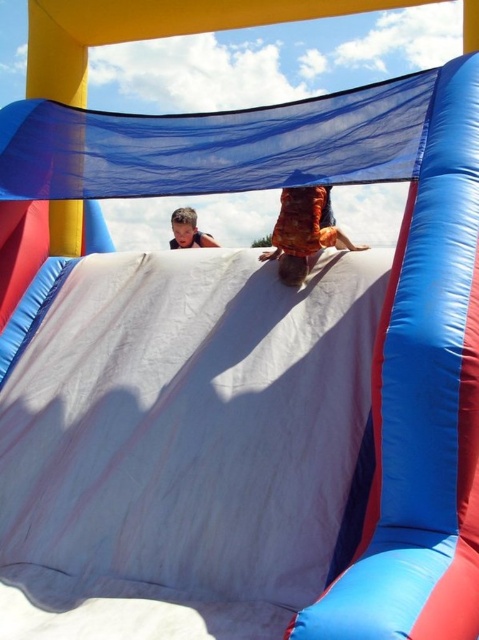
Looking at this image, you are a photographer trying to capture a photo of the blue fabric slide at upper center and the light brown hair at upper center. Which object should you focus on first if you want to ensure both are in the frame without moving the camera?

The blue fabric slide at upper center is positioned on the right side of light brown hair at upper center. To include both in the frame without moving the camera, focus on the light brown hair at upper center first since it is on the left, allowing the blue fabric slide at upper center to naturally fall into the right side of the frame.

You are a photographer trying to capture a clear photo of the orange cotton shirt at center without the blue fabric slide at upper center blocking it. How should you adjust your camera position?

Move the camera backward so that the orange cotton shirt at center comes into focus while the blue fabric slide at upper center moves out of the frame.